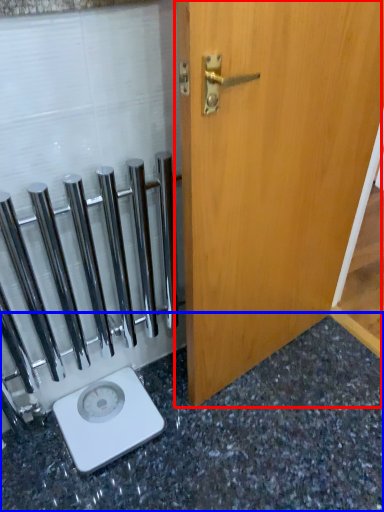
Question: Which object appears farthest to the camera in this image, door (highlighted by a red box) or granite (highlighted by a blue box)?

Choices:
 (A) door
 (B) granite

Answer: (B)